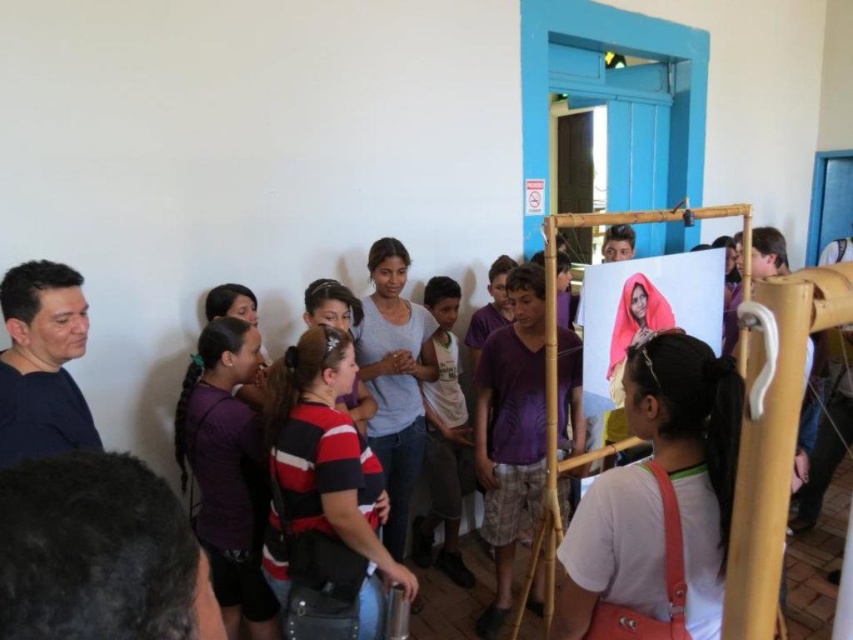
Does striped fabric shirt at center have a lesser height compared to purple fabric shirt at lower left?

Yes, striped fabric shirt at center is shorter than purple fabric shirt at lower left.

Is striped fabric shirt at center to the right of purple fabric shirt at lower left from the viewer's perspective?

Indeed, striped fabric shirt at center is positioned on the right side of purple fabric shirt at lower left.

What do you see at coordinates (323, 484) in the screenshot? I see `striped fabric shirt at center` at bounding box center [323, 484].

The height and width of the screenshot is (640, 853). I want to click on striped fabric shirt at center, so click(x=323, y=484).

Between white fabric at center and striped fabric shirt at center, which one has more height?

Standing taller between the two is striped fabric shirt at center.

Is white fabric at center positioned in front of striped fabric shirt at center?

Yes.

Locate an element on the screen. The height and width of the screenshot is (640, 853). white fabric at center is located at coordinates (659, 506).

Who is positioned more to the right, white fabric at center or purple fabric shirt at lower left?

Positioned to the right is white fabric at center.

Does white fabric at center appear under purple fabric shirt at lower left?

No, white fabric at center is not below purple fabric shirt at lower left.

Is point (706, 637) behind point (212, 353)?

That is False.

This screenshot has height=640, width=853. What are the coordinates of `white fabric at center` in the screenshot? It's located at (659, 506).